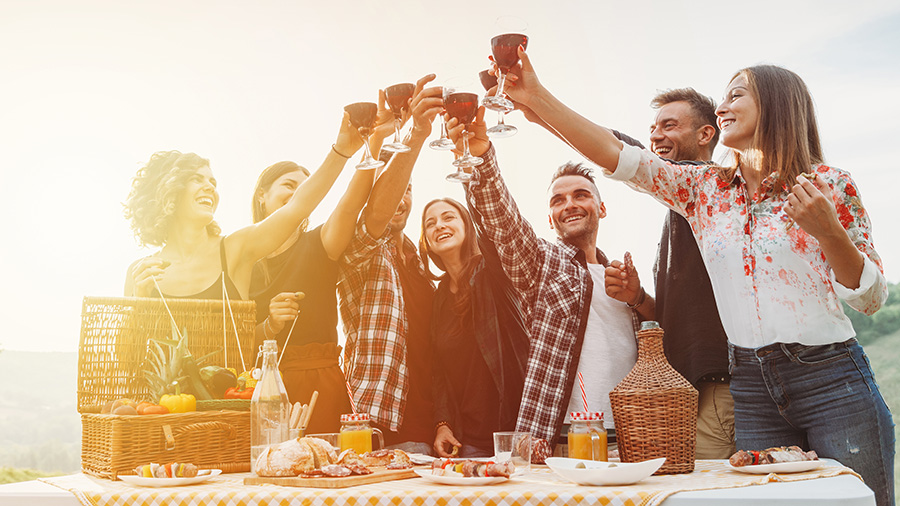
The width and height of the screenshot is (900, 506). In order to click on 4 dishes in this screenshot , I will do `click(184, 484)`, `click(457, 480)`, `click(581, 477)`, `click(777, 467)`.